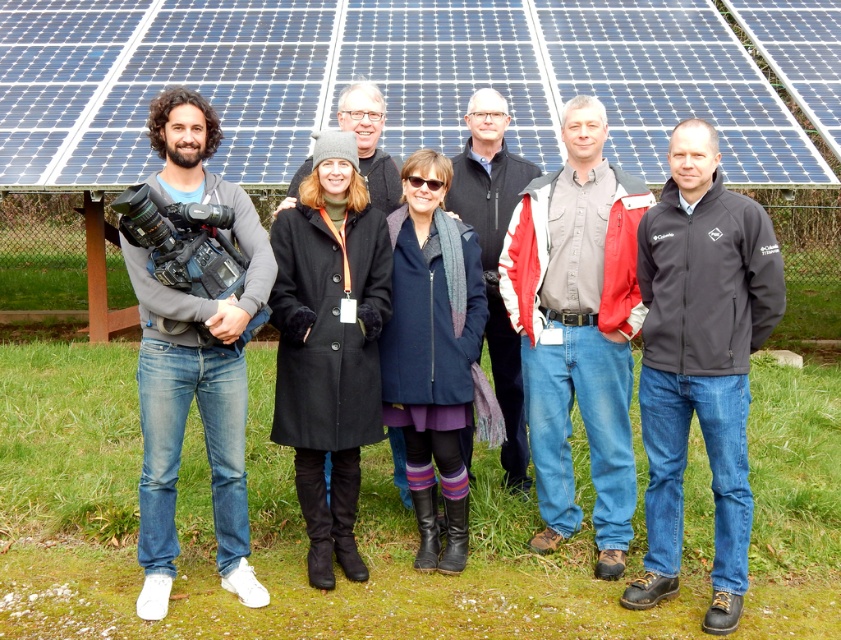
Question: Is matte black camera at left to the left of black softshell jacket at center from the viewer's perspective?

Choices:
 (A) yes
 (B) no

Answer: (A)

Question: Among these objects, which one is farthest from the camera?

Choices:
 (A) black softshell jacket at center
 (B) red jacket at center

Answer: (A)

Question: Among these points, which one is farthest from the camera?

Choices:
 (A) (255, 266)
 (B) (653, 429)
 (C) (479, 218)
 (D) (366, 93)

Answer: (C)

Question: Does red jacket at center appear on the left side of black wool coat at center?

Choices:
 (A) yes
 (B) no

Answer: (B)

Question: Which object is the closest to the black softshell jacket at center?

Choices:
 (A) black wool coat at center
 (B) dark gray softshell jacket at center
 (C) red jacket at center
 (D) matte black camera at left

Answer: (C)

Question: Considering the relative positions of matte black camera at left and black softshell jacket at center in the image provided, where is matte black camera at left located with respect to black softshell jacket at center?

Choices:
 (A) below
 (B) above

Answer: (A)